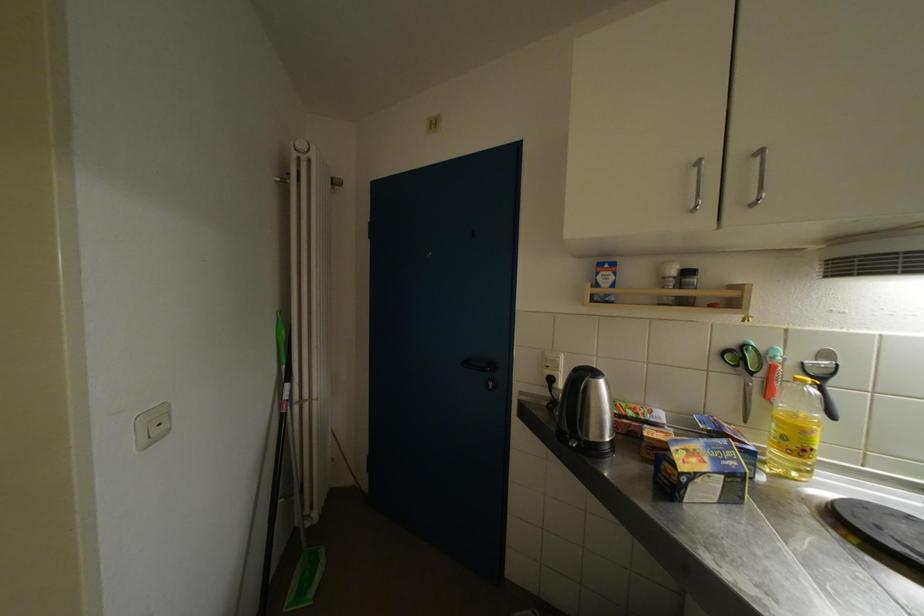
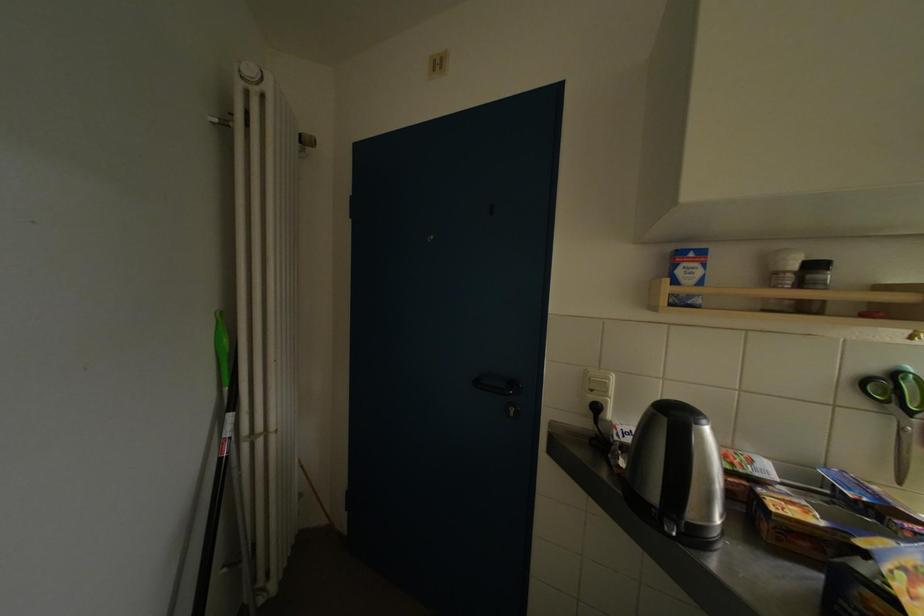
Locate, in the second image, the point that corresponds to point (553, 371) in the first image.

(599, 394)